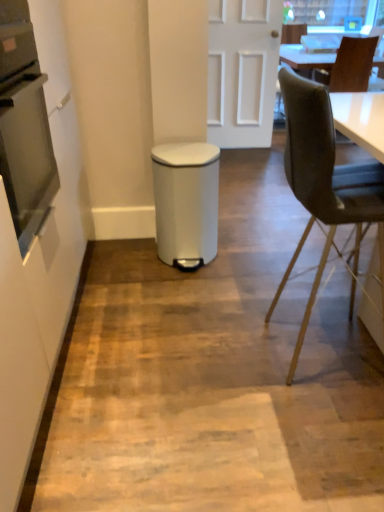
Find the location of a particular element. This screenshot has height=512, width=384. free space in front of velvet black chair at right, positioned as the first chair in bottom-to-top order is located at coordinates (318, 425).